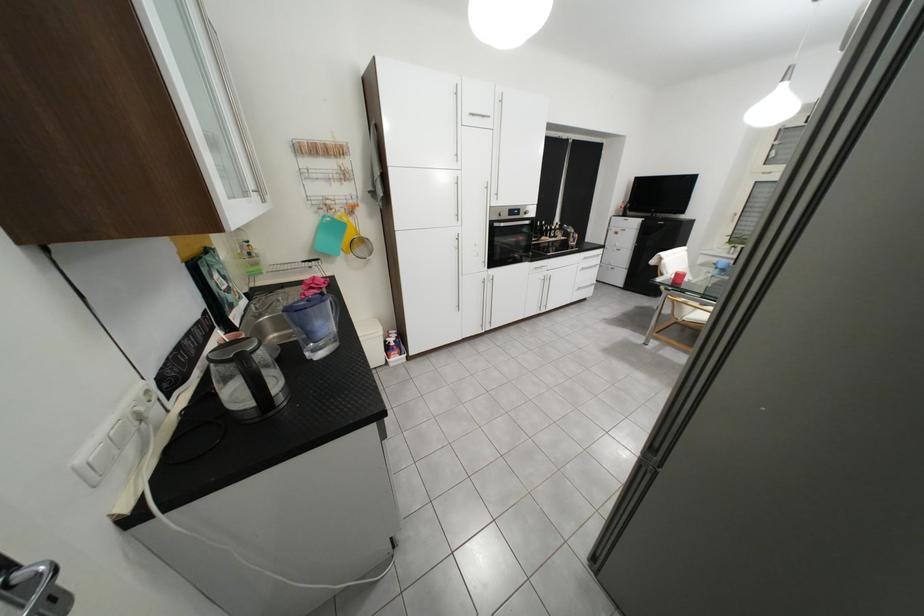
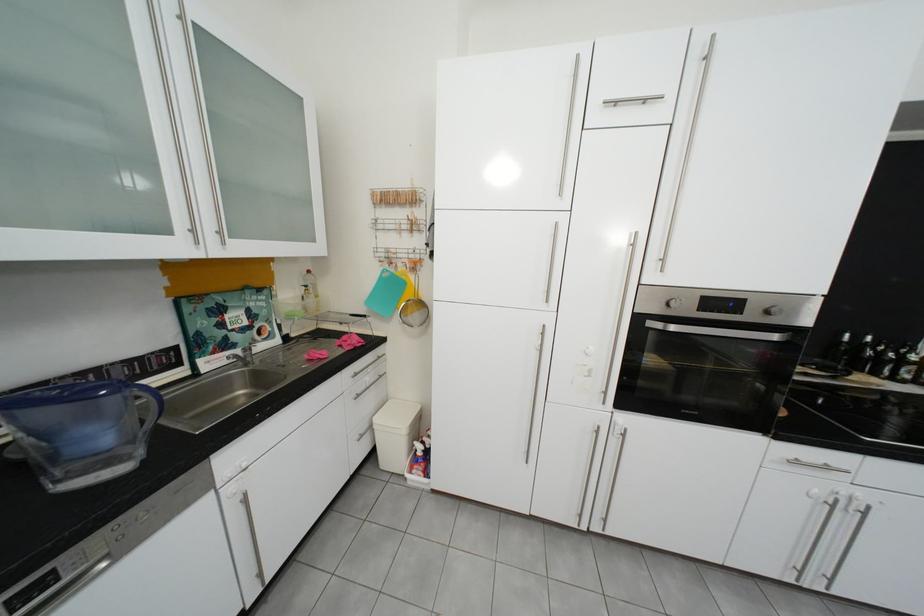
The point at (558, 237) is marked in the first image. Where is the corresponding point in the second image?

(886, 375)